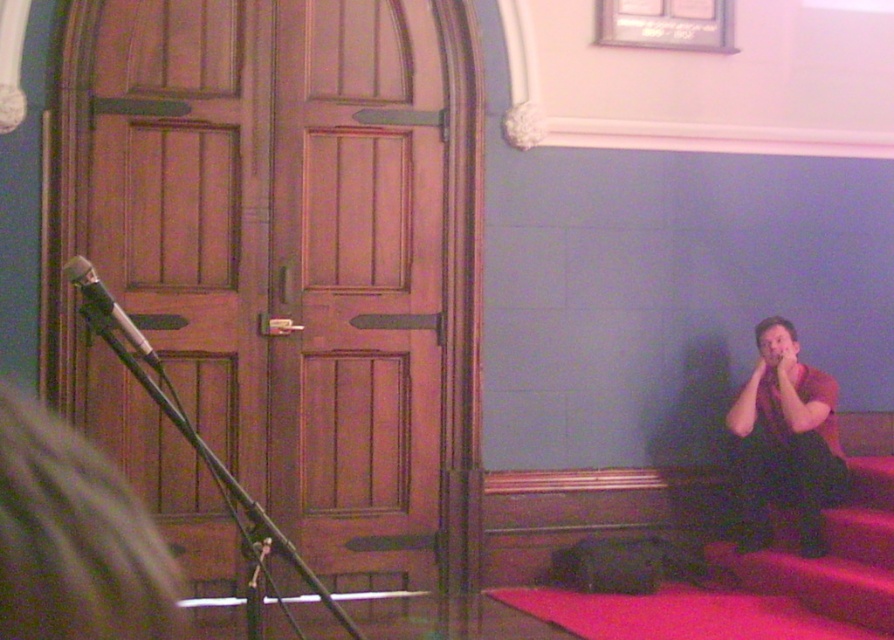
Question: Can you confirm if matte black microphone at left is positioned to the left of dark red shirt at right?

Choices:
 (A) no
 (B) yes

Answer: (B)

Question: Is matte black microphone at left positioned at the back of dark red shirt at right?

Choices:
 (A) yes
 (B) no

Answer: (B)

Question: Which of these objects is positioned closest to the dark red shirt at right?

Choices:
 (A) metallic silver microphone at left
 (B) matte black microphone at left
 (C) smooth wooden stairs at lower right

Answer: (C)

Question: Among these points, which one is farthest from the camera?

Choices:
 (A) (89, 292)
 (B) (30, 410)
 (C) (748, 397)

Answer: (C)

Question: Which of the following is the closest to the observer?

Choices:
 (A) metallic silver microphone at left
 (B) matte black microphone at left

Answer: (A)

Question: Can you confirm if matte black microphone at left is bigger than metallic silver microphone at left?

Choices:
 (A) no
 (B) yes

Answer: (B)